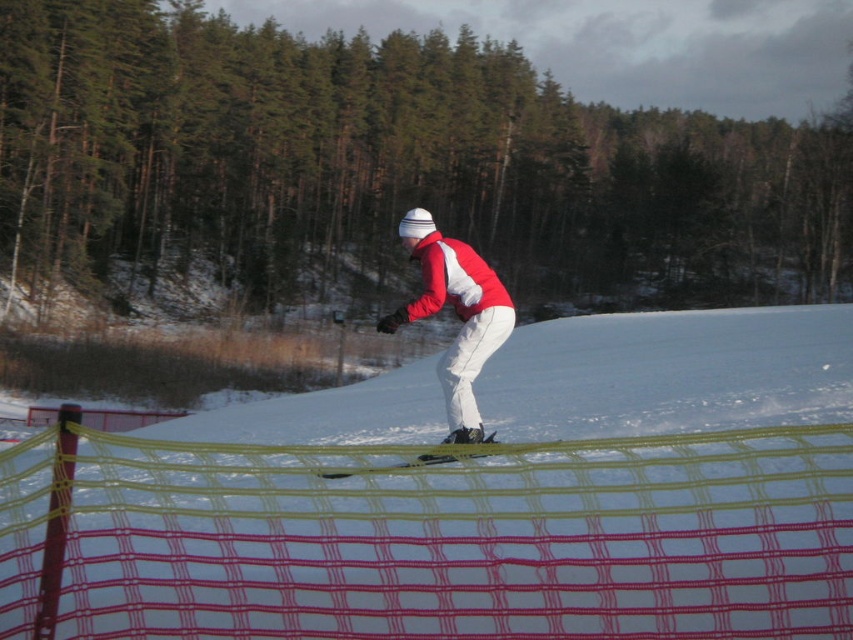
Between point (838, 452) and point (491, 268), which one is positioned in front?

Positioned in front is point (838, 452).

Is yellow mesh fence at center wider than matte red snowboarder at center?

Yes, yellow mesh fence at center is wider than matte red snowboarder at center.

Who is more distant from viewer, (526,618) or (479,301)?

Positioned behind is point (479,301).

Find the location of a particular element. yellow mesh fence at center is located at coordinates (428, 538).

Between point (790, 228) and point (463, 300), which one is positioned in front?

Positioned in front is point (463, 300).

Between point (691, 246) and point (463, 380), which one is positioned behind?

The point (691, 246) is more distant.

Between point (102, 88) and point (424, 308), which one is positioned behind?

The point (102, 88) is more distant.

What are the coordinates of `green leafy tree at upper center` in the screenshot? It's located at (384, 166).

Between green leafy tree at upper center and yellow mesh fence at center, which one is positioned higher?

green leafy tree at upper center

Looking at this image, between green leafy tree at upper center and yellow mesh fence at center, which one appears on the right side from the viewer's perspective?

green leafy tree at upper center is more to the right.

The image size is (853, 640). What do you see at coordinates (384, 166) in the screenshot? I see `green leafy tree at upper center` at bounding box center [384, 166].

Locate an element on the screen. This screenshot has height=640, width=853. green leafy tree at upper center is located at coordinates (384, 166).